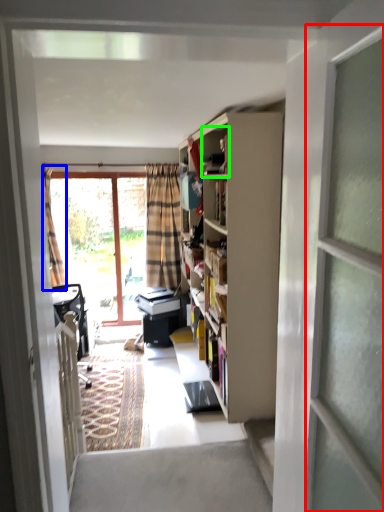
Question: Which object is the closest to the screen door (highlighted by a red box)? Choose among these: curtain (highlighted by a blue box) or cabinet (highlighted by a green box).

Choices:
 (A) curtain
 (B) cabinet

Answer: (B)